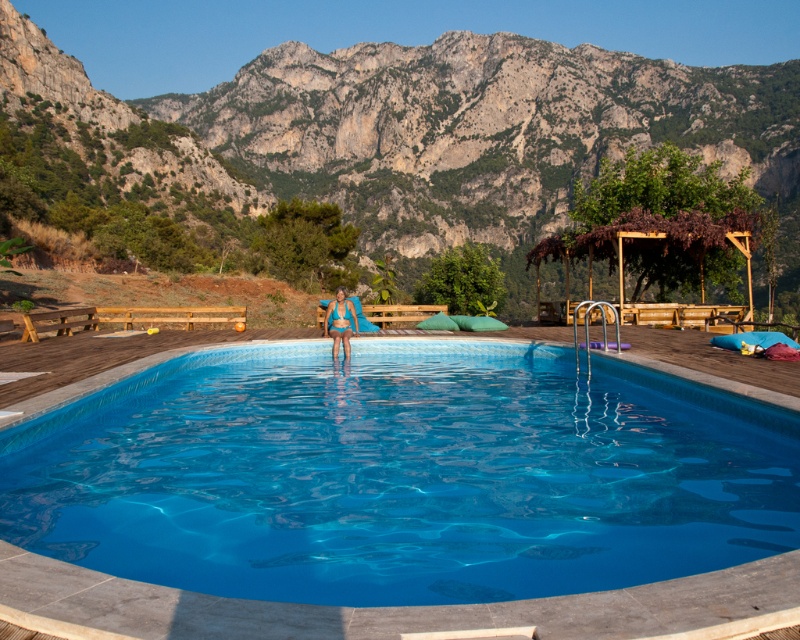
Which of these two, blue tile swimming pool at center or rugged stone mountain at upper center, stands shorter?

With less height is blue tile swimming pool at center.

Is point (248, 486) behind point (262, 52)?

No.

Identify the location of blue tile swimming pool at center. This screenshot has height=640, width=800. 401,476.

Image resolution: width=800 pixels, height=640 pixels. In order to click on blue tile swimming pool at center in this screenshot , I will do `click(401, 476)`.

Which is in front, point (380, 369) or point (350, 328)?

Point (380, 369) is more forward.

Where is `blue tile swimming pool at center`? The height and width of the screenshot is (640, 800). blue tile swimming pool at center is located at coordinates (401, 476).

Is rugged stone mountain at upper center smaller than blue fabric at center?

No, rugged stone mountain at upper center is not smaller than blue fabric at center.

Who is taller, rugged stone mountain at upper center or blue fabric at center?

With more height is rugged stone mountain at upper center.

Where is `rugged stone mountain at upper center`? rugged stone mountain at upper center is located at coordinates (428, 131).

Locate an element on the screen. The height and width of the screenshot is (640, 800). rugged stone mountain at upper center is located at coordinates (428, 131).